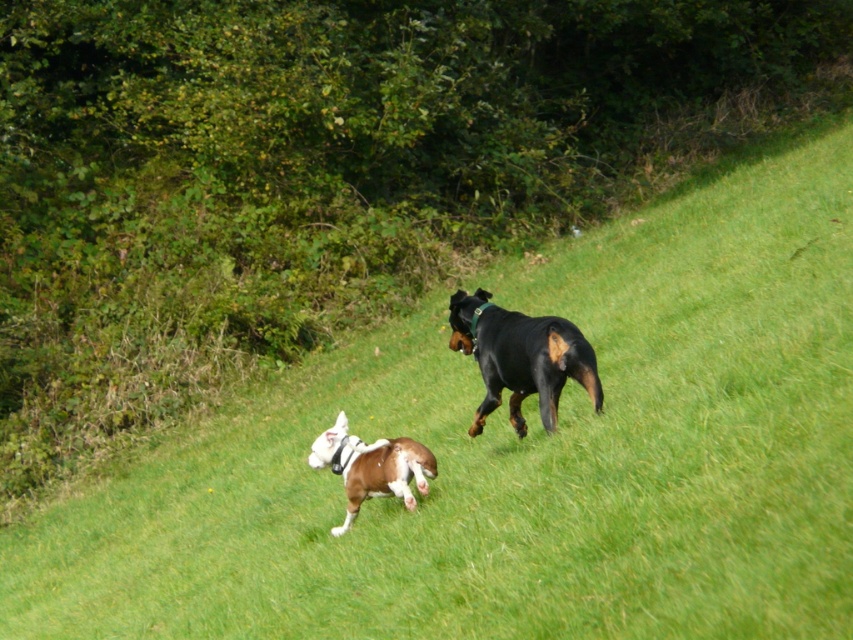
Can you confirm if black glossy dog at center is shorter than brown glossy dog at center?

Incorrect, black glossy dog at center's height does not fall short of brown glossy dog at center's.

Can you confirm if black glossy dog at center is bigger than brown glossy dog at center?

Yes.

Which is behind, point (480, 316) or point (347, 440)?

Point (480, 316)

Identify the location of black glossy dog at center. (521, 358).